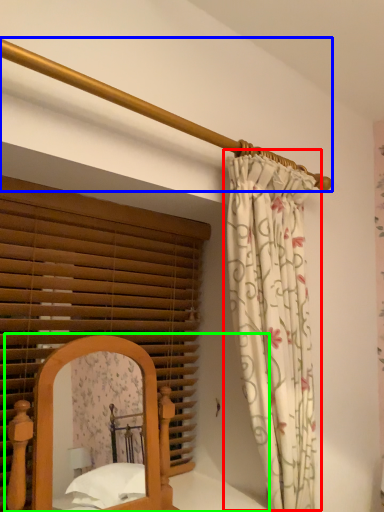
Question: Estimate the real-world distances between objects in this image. Which object is closer to curtain (highlighted by a red box), balustrade (highlighted by a blue box) or bed (highlighted by a green box)?

Choices:
 (A) balustrade
 (B) bed

Answer: (A)